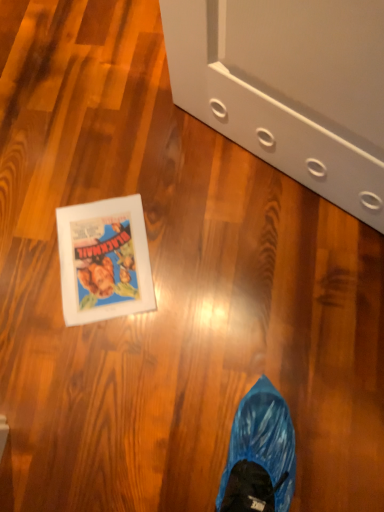
The width and height of the screenshot is (384, 512). What are the coordinates of `unoccupied space behind matte paper comic book at lower left` in the screenshot? It's located at (102, 167).